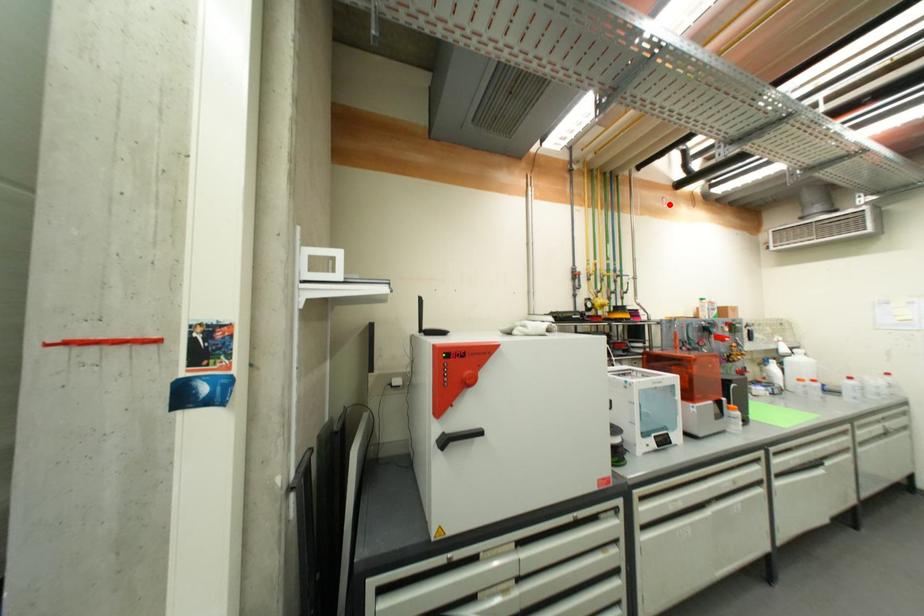
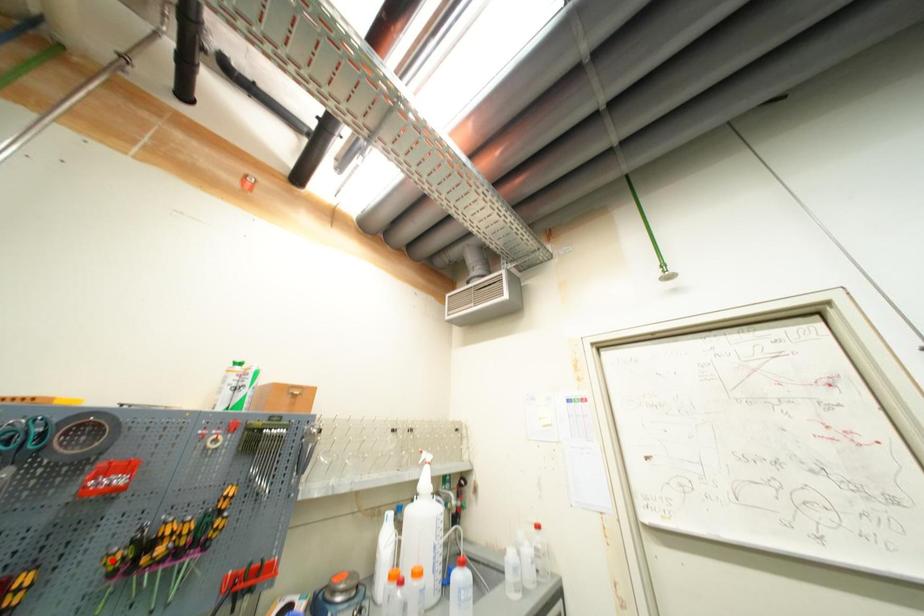
I am providing you with two images of the same scene from different viewpoints. A red point is marked on the first image and another point is marked on the second image. Do the highlighted points in image1 and image2 indicate the same real-world spot?

No